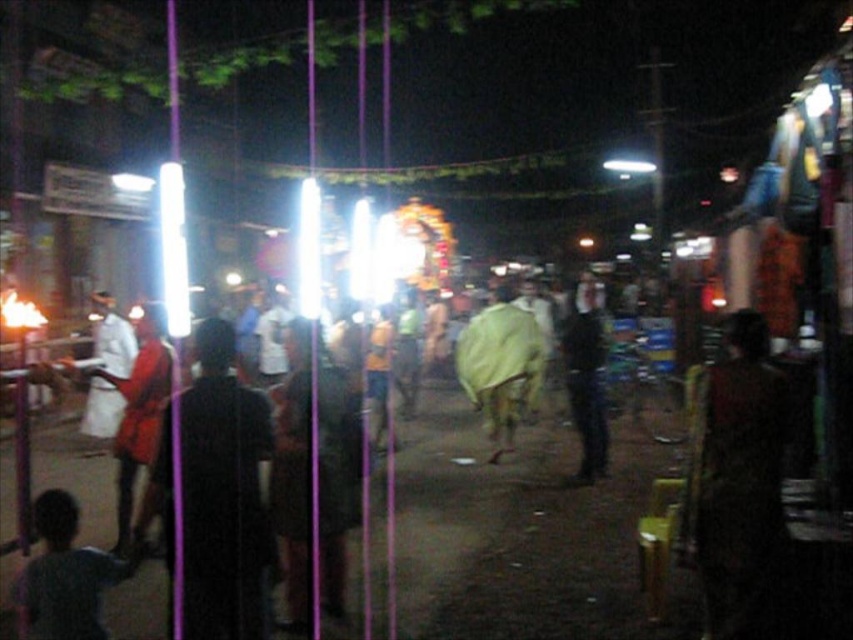
Does black matte coat at center lie in front of dark gray shirt at lower left?

Yes, it is in front of dark gray shirt at lower left.

Is point (187, 408) behind point (76, 582)?

That is False.

Does point (201, 355) come farther from viewer compared to point (33, 500)?

No.

The image size is (853, 640). I want to click on black matte coat at center, so click(222, 493).

Can you confirm if dark brown textured shirt at center is taller than black matte jacket at center?

No, dark brown textured shirt at center is not taller than black matte jacket at center.

Does point (756, 480) come closer to viewer compared to point (595, 346)?

That is True.

Image resolution: width=853 pixels, height=640 pixels. What do you see at coordinates (738, 484) in the screenshot?
I see `dark brown textured shirt at center` at bounding box center [738, 484].

Locate an element on the screen. The height and width of the screenshot is (640, 853). dark brown textured shirt at center is located at coordinates (738, 484).

Who is higher up, dark brown textured shirt at center or yellow fabric at center?

yellow fabric at center is higher up.

Is point (752, 499) positioned behind point (521, 332)?

No.

Is point (779, 582) in front of point (492, 305)?

Yes, point (779, 582) is in front of point (492, 305).

Locate an element on the screen. The width and height of the screenshot is (853, 640). dark brown textured shirt at center is located at coordinates tap(738, 484).